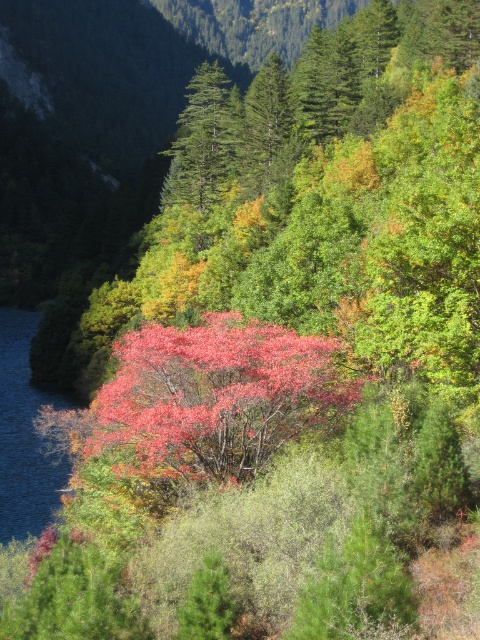
Question: Which of the following is the closest to the observer?

Choices:
 (A) pyautogui.click(x=22, y=506)
 (B) pyautogui.click(x=179, y=140)

Answer: (A)

Question: Which of the following is the farthest from the observer?

Choices:
 (A) (16, 332)
 (B) (206, 68)

Answer: (A)

Question: Which object appears closest to the camera in this image?

Choices:
 (A) green matte tree at center
 (B) blue liquid water at left

Answer: (B)

Question: Is the position of blue liquid water at left more distant than that of green matte tree at center?

Choices:
 (A) yes
 (B) no

Answer: (B)

Question: In this image, where is blue liquid water at left located relative to green matte tree at center?

Choices:
 (A) right
 (B) left

Answer: (B)

Question: In this image, where is blue liquid water at left located relative to green matte tree at center?

Choices:
 (A) below
 (B) above

Answer: (A)